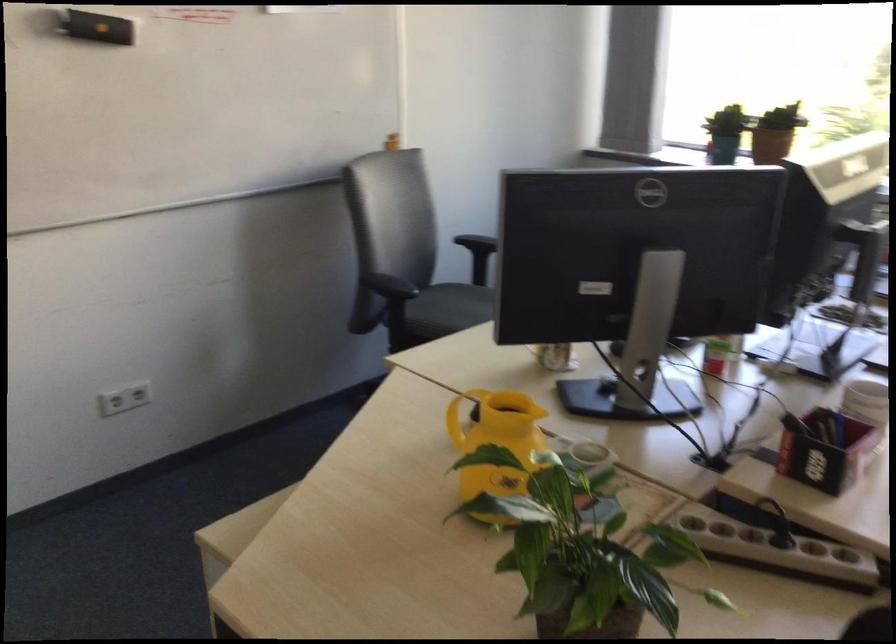
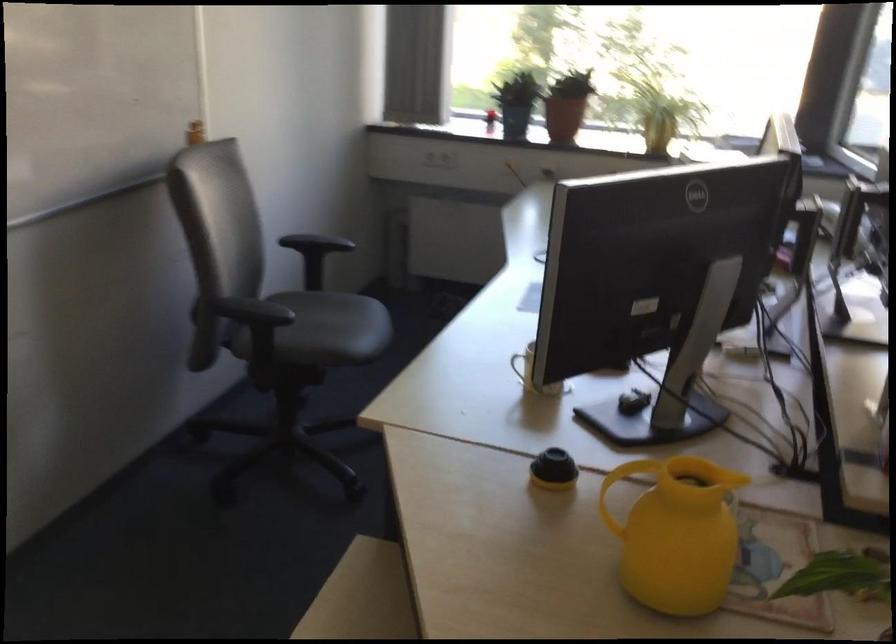
What movement of the cameraman would produce the second image?

The cameraman walked toward left, forward.